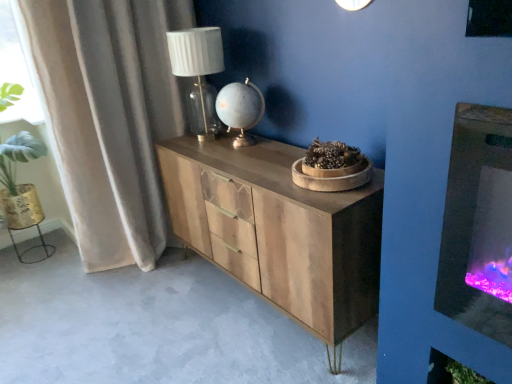
Question: From a real-world perspective, is matte white glass table lamp at upper center on top of velvet beige curtain at left?

Choices:
 (A) no
 (B) yes

Answer: (B)

Question: From the image's perspective, would you say matte white glass table lamp at upper center is shown under velvet beige curtain at left?

Choices:
 (A) yes
 (B) no

Answer: (B)

Question: Can you confirm if matte white glass table lamp at upper center is positioned to the left of velvet beige curtain at left?

Choices:
 (A) no
 (B) yes

Answer: (A)

Question: Can you confirm if matte white glass table lamp at upper center is bigger than velvet beige curtain at left?

Choices:
 (A) yes
 (B) no

Answer: (B)

Question: Is matte white glass table lamp at upper center oriented towards velvet beige curtain at left?

Choices:
 (A) yes
 (B) no

Answer: (B)

Question: Does point (73, 173) appear closer or farther from the camera than point (330, 215)?

Choices:
 (A) farther
 (B) closer

Answer: (A)

Question: Considering the positions of velvet beige curtain at left and wooden chest of drawers at center in the image, is velvet beige curtain at left taller or shorter than wooden chest of drawers at center?

Choices:
 (A) tall
 (B) short

Answer: (A)

Question: In the image, is velvet beige curtain at left positioned in front of or behind wooden chest of drawers at center?

Choices:
 (A) behind
 (B) front

Answer: (A)

Question: In terms of size, does velvet beige curtain at left appear bigger or smaller than wooden chest of drawers at center?

Choices:
 (A) big
 (B) small

Answer: (B)

Question: Considering the positions of matte white glass table lamp at upper center and wooden chest of drawers at center in the image, is matte white glass table lamp at upper center wider or thinner than wooden chest of drawers at center?

Choices:
 (A) wide
 (B) thin

Answer: (B)

Question: Is matte white glass table lamp at upper center in front of or behind wooden chest of drawers at center in the image?

Choices:
 (A) behind
 (B) front

Answer: (A)

Question: Does point (185, 49) appear closer or farther from the camera than point (199, 162)?

Choices:
 (A) closer
 (B) farther

Answer: (B)

Question: Is matte white glass table lamp at upper center bigger or smaller than wooden chest of drawers at center?

Choices:
 (A) small
 (B) big

Answer: (A)

Question: In terms of height, does velvet beige curtain at left look taller or shorter compared to matte white glass table lamp at upper center?

Choices:
 (A) short
 (B) tall

Answer: (B)

Question: Would you say velvet beige curtain at left is inside or outside matte white glass table lamp at upper center?

Choices:
 (A) inside
 (B) outside

Answer: (B)